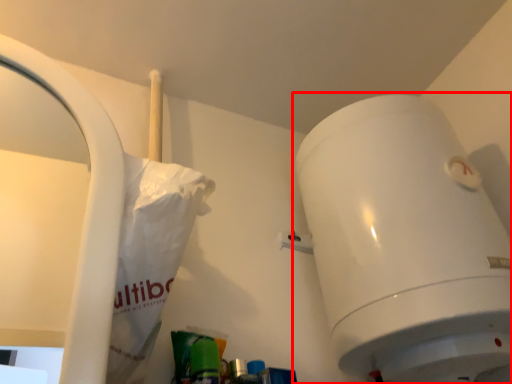
Question: From the image's perspective, what is the correct spatial positioning of toilet (annotated by the red box) in reference to paper bag?

Choices:
 (A) below
 (B) above

Answer: (A)